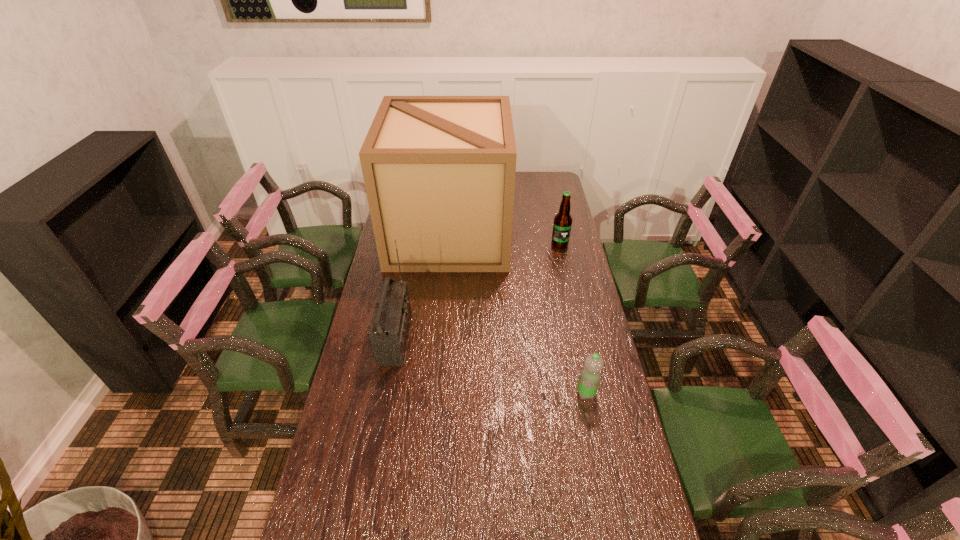
Where is `box situated at the left edge`? This screenshot has height=540, width=960. box situated at the left edge is located at coordinates (439, 171).

Identify the location of radio receiver that is at the left edge. (389, 328).

Find the location of `beer bottle that is positioned at the right edge`. beer bottle that is positioned at the right edge is located at coordinates (562, 224).

At what (x,y) coordinates should I click in order to perform the action: click on water bottle positioned at the right edge. Please return your answer as a coordinate pair (x, y). The image size is (960, 540). Looking at the image, I should click on (590, 375).

This screenshot has width=960, height=540. What are the coordinates of `vacant space at the left edge of the desktop` in the screenshot? It's located at pos(368,356).

The height and width of the screenshot is (540, 960). I want to click on free spot at the right edge of the desktop, so click(x=564, y=324).

In the image, there is a desktop. Find the location of `vacant area at the far right corner`. vacant area at the far right corner is located at coordinates pos(539,175).

The width and height of the screenshot is (960, 540). Identify the location of vacant space in between the shortest object and the box. (517, 314).

Locate an element on the screen. The image size is (960, 540). vacant area that lies between the radio receiver and the tallest object is located at coordinates (422, 286).

Identify the location of free space between the radio receiver and the water bottle. (491, 366).